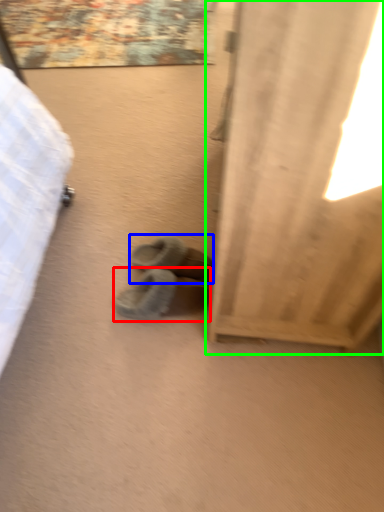
Question: Considering the real-world distances, which object is closest to footwear (highlighted by a red box)? footwear (highlighted by a blue box) or curtain (highlighted by a green box).

Choices:
 (A) footwear
 (B) curtain

Answer: (A)